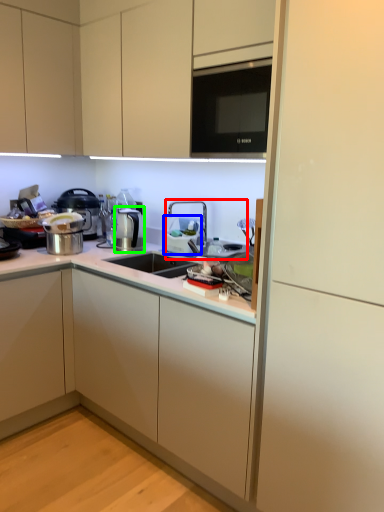
Question: Which is farther away from sink (highlighted by a red box)? appliance (highlighted by a blue box) or coffee machine (highlighted by a green box)?

Choices:
 (A) appliance
 (B) coffee machine

Answer: (B)